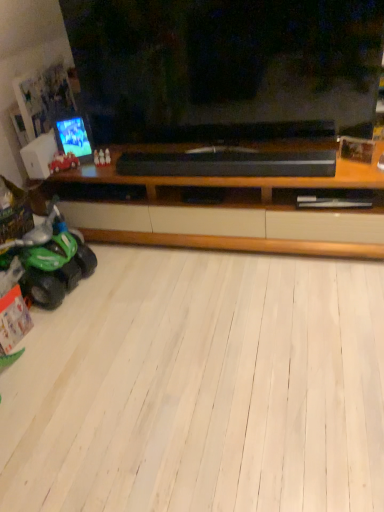
Question: Is green plastic toy car at lower left, which is the first land vehicle from bottom to top, facing away from shiny red toy car at left, which appears as the 2th land vehicle when ordered from the bottom?

Choices:
 (A) yes
 (B) no

Answer: (B)

Question: Considering the relative sizes of green plastic toy car at lower left, which is the first land vehicle from bottom to top, and shiny red toy car at left, the first land vehicle viewed from the top, in the image provided, is green plastic toy car at lower left, which is the first land vehicle from bottom to top, smaller than shiny red toy car at left, the first land vehicle viewed from the top,?

Choices:
 (A) yes
 (B) no

Answer: (B)

Question: Can you confirm if green plastic toy car at lower left, which appears as the 2th land vehicle when viewed from the top, is wider than shiny red toy car at left, which appears as the 2th land vehicle when ordered from the bottom?

Choices:
 (A) yes
 (B) no

Answer: (A)

Question: Would you say shiny red toy car at left, which appears as the 2th land vehicle when ordered from the bottom, is part of green plastic toy car at lower left, which is the first land vehicle from bottom to top,'s contents?

Choices:
 (A) yes
 (B) no

Answer: (B)

Question: Does green plastic toy car at lower left, which appears as the 2th land vehicle when viewed from the top, have a larger size compared to shiny red toy car at left, which appears as the 2th land vehicle when ordered from the bottom?

Choices:
 (A) yes
 (B) no

Answer: (A)

Question: Is green plastic toy car at lower left, which is the first land vehicle from bottom to top, oriented towards shiny red toy car at left, the first land vehicle viewed from the top?

Choices:
 (A) no
 (B) yes

Answer: (A)

Question: Is shiny red toy car at left, which appears as the 2th land vehicle when ordered from the bottom, closer to camera compared to white plastic speaker at left?

Choices:
 (A) no
 (B) yes

Answer: (A)

Question: Considering the relative positions of shiny red toy car at left, which appears as the 2th land vehicle when ordered from the bottom, and white plastic speaker at left in the image provided, is shiny red toy car at left, which appears as the 2th land vehicle when ordered from the bottom, to the right of white plastic speaker at left from the viewer's perspective?

Choices:
 (A) no
 (B) yes

Answer: (B)

Question: Is shiny red toy car at left, which appears as the 2th land vehicle when ordered from the bottom, far from white plastic speaker at left?

Choices:
 (A) no
 (B) yes

Answer: (A)

Question: From the image's perspective, is shiny red toy car at left, which appears as the 2th land vehicle when ordered from the bottom, on top of white plastic speaker at left?

Choices:
 (A) no
 (B) yes

Answer: (A)

Question: Is shiny red toy car at left, which appears as the 2th land vehicle when ordered from the bottom, with white plastic speaker at left?

Choices:
 (A) yes
 (B) no

Answer: (A)

Question: Could you tell me if shiny red toy car at left, the first land vehicle viewed from the top, is facing white plastic speaker at left?

Choices:
 (A) no
 (B) yes

Answer: (A)

Question: Can you confirm if shiny plastic phone at left is shorter than white plastic speaker at left?

Choices:
 (A) no
 (B) yes

Answer: (A)